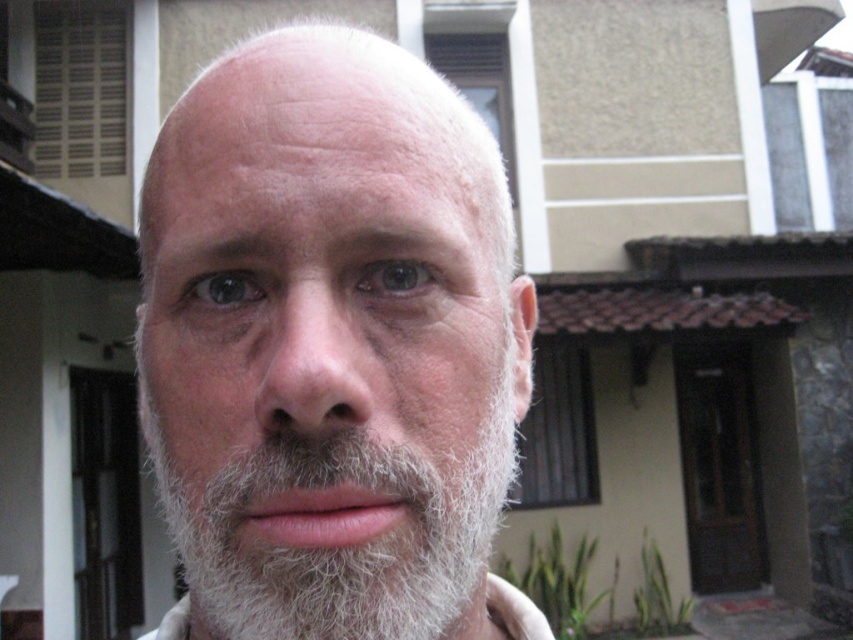
Question: Does gray fuzzy beard at center lie in front of white matte hair at center?

Choices:
 (A) yes
 (B) no

Answer: (A)

Question: Which of the following is the closest to the observer?

Choices:
 (A) gray fuzzy beard at center
 (B) white matte hair at center

Answer: (A)

Question: Is gray fuzzy beard at center above white matte hair at center?

Choices:
 (A) no
 (B) yes

Answer: (A)

Question: Can you confirm if gray fuzzy beard at center is thinner than white matte hair at center?

Choices:
 (A) yes
 (B) no

Answer: (B)

Question: Which point is closer to the camera taking this photo?

Choices:
 (A) (450, 150)
 (B) (244, 499)

Answer: (B)

Question: Which of the following is the closest to the observer?

Choices:
 (A) (279, 72)
 (B) (445, 544)

Answer: (B)